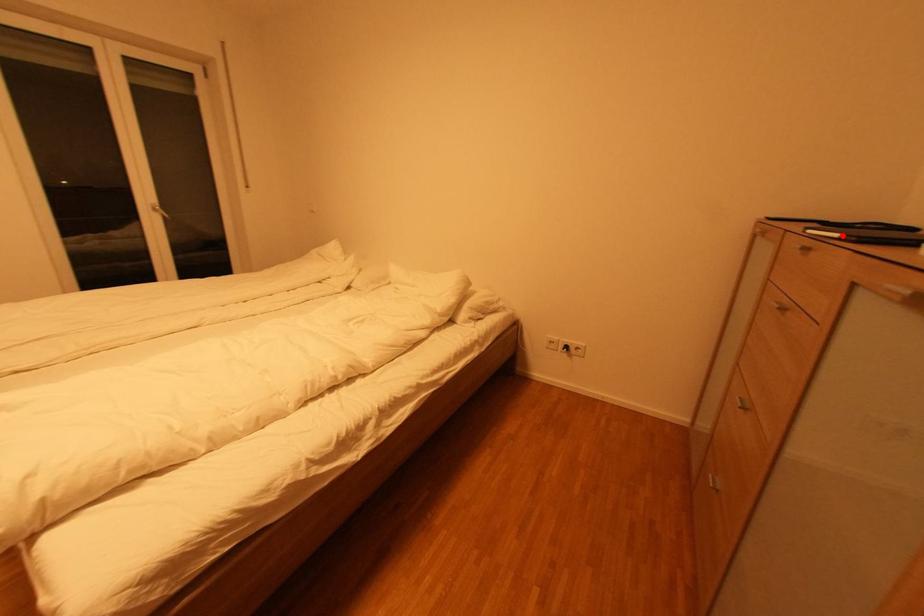
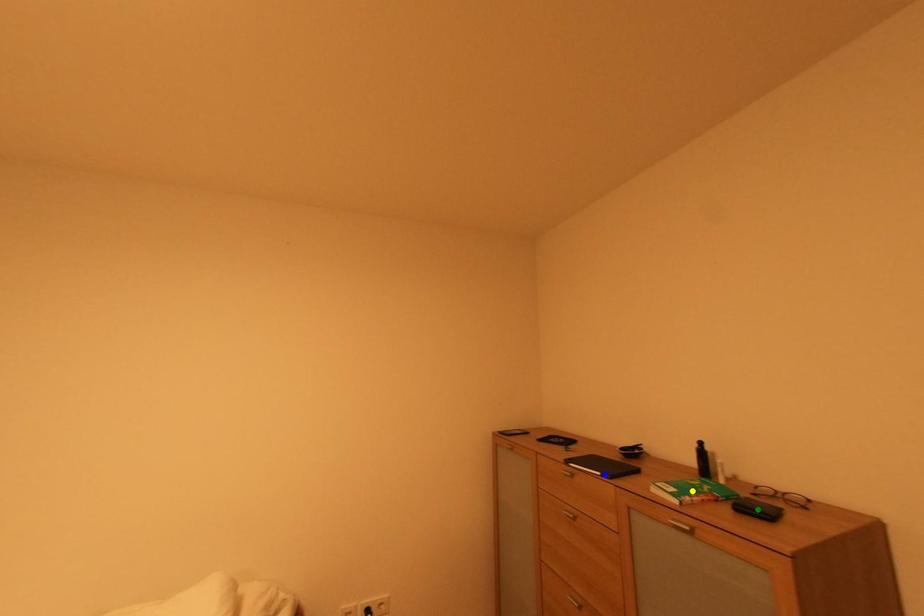
Question: I am providing you with two images of the same scene from different viewpoints. A red point is marked on the first image. You are given multiple points on the second image. Which mark in image 2 goes with the point in image 1?

Choices:
 (A) yellow point
 (B) green point
 (C) blue point

Answer: (C)